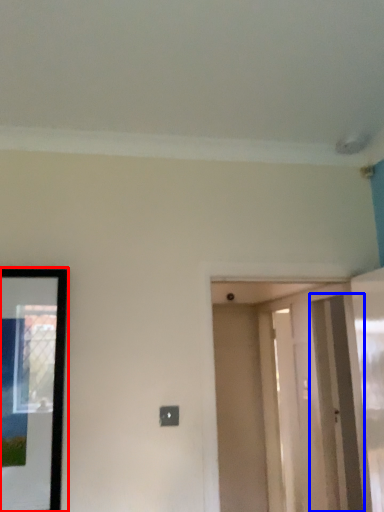
Question: Which of the following is the closest to the observer, picture frame (highlighted by a red box) or screen door (highlighted by a blue box)?

Choices:
 (A) picture frame
 (B) screen door

Answer: (A)